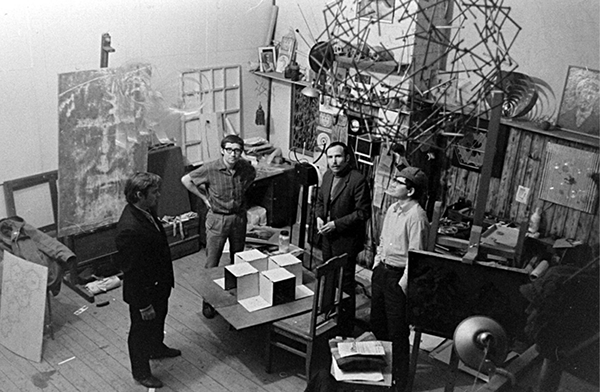
This screenshot has width=600, height=392. I want to click on table, so click(x=245, y=320).